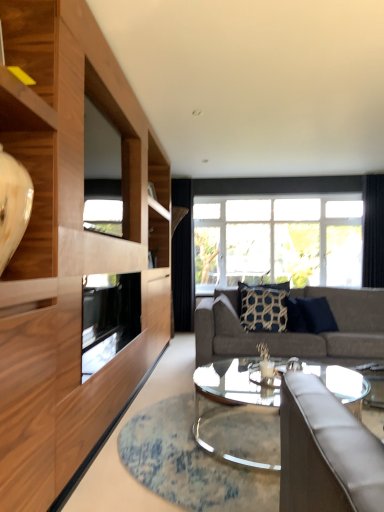
Question: Is dark blue textured pillow at center, acting as the first pillow starting from the right, to the left of clear glass coffee table at center from the viewer's perspective?

Choices:
 (A) yes
 (B) no

Answer: (B)

Question: Considering the relative sizes of dark blue textured pillow at center, acting as the first pillow starting from the right, and clear glass coffee table at center in the image provided, is dark blue textured pillow at center, acting as the first pillow starting from the right, bigger than clear glass coffee table at center?

Choices:
 (A) yes
 (B) no

Answer: (B)

Question: Is dark blue textured pillow at center, acting as the first pillow starting from the right, shorter than clear glass coffee table at center?

Choices:
 (A) no
 (B) yes

Answer: (A)

Question: From a real-world perspective, does dark blue textured pillow at center, positioned as the 2th pillow in left-to-right order, sit lower than clear glass coffee table at center?

Choices:
 (A) no
 (B) yes

Answer: (A)

Question: Is dark blue textured pillow at center, acting as the first pillow starting from the right, positioned far away from clear glass coffee table at center?

Choices:
 (A) yes
 (B) no

Answer: (A)

Question: Choose the correct answer: Is clear glass window at center inside transparent glass window screen at upper left or outside it?

Choices:
 (A) inside
 (B) outside

Answer: (B)

Question: Is point (223, 223) positioned closer to the camera than point (119, 139)?

Choices:
 (A) closer
 (B) farther

Answer: (B)

Question: Is clear glass window at center to the left or to the right of transparent glass window screen at upper left in the image?

Choices:
 (A) left
 (B) right

Answer: (B)

Question: Is clear glass window at center in front of or behind transparent glass window screen at upper left in the image?

Choices:
 (A) behind
 (B) front

Answer: (A)

Question: Choose the correct answer: Is navy blue textured pillow at center, which is counted as the second pillow, starting from the right, inside clear glass coffee table at center or outside it?

Choices:
 (A) inside
 (B) outside

Answer: (B)

Question: From a real-world perspective, is navy blue textured pillow at center, which is counted as the second pillow, starting from the right, positioned above or below clear glass coffee table at center?

Choices:
 (A) below
 (B) above

Answer: (B)

Question: Based on their positions, is navy blue textured pillow at center, the first pillow when ordered from left to right, located to the left or right of clear glass coffee table at center?

Choices:
 (A) left
 (B) right

Answer: (B)

Question: Is navy blue textured pillow at center, the first pillow when ordered from left to right, in front of or behind clear glass coffee table at center in the image?

Choices:
 (A) behind
 (B) front

Answer: (A)

Question: Visually, is gray fabric couch at center positioned to the left or to the right of navy blue textured pillow at center, which is counted as the second pillow, starting from the right?

Choices:
 (A) right
 (B) left

Answer: (A)

Question: Does point (228, 294) appear closer or farther from the camera than point (266, 298)?

Choices:
 (A) farther
 (B) closer

Answer: (A)